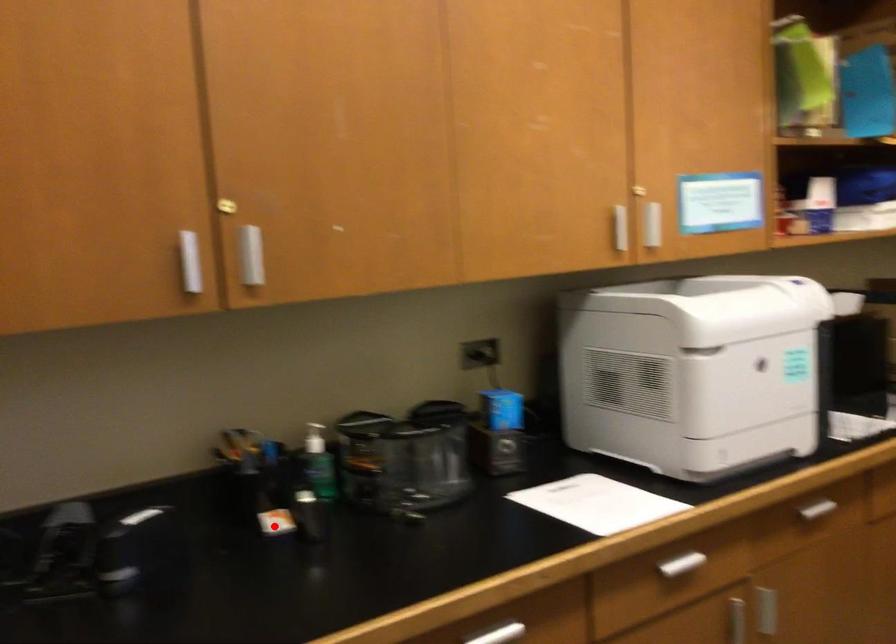
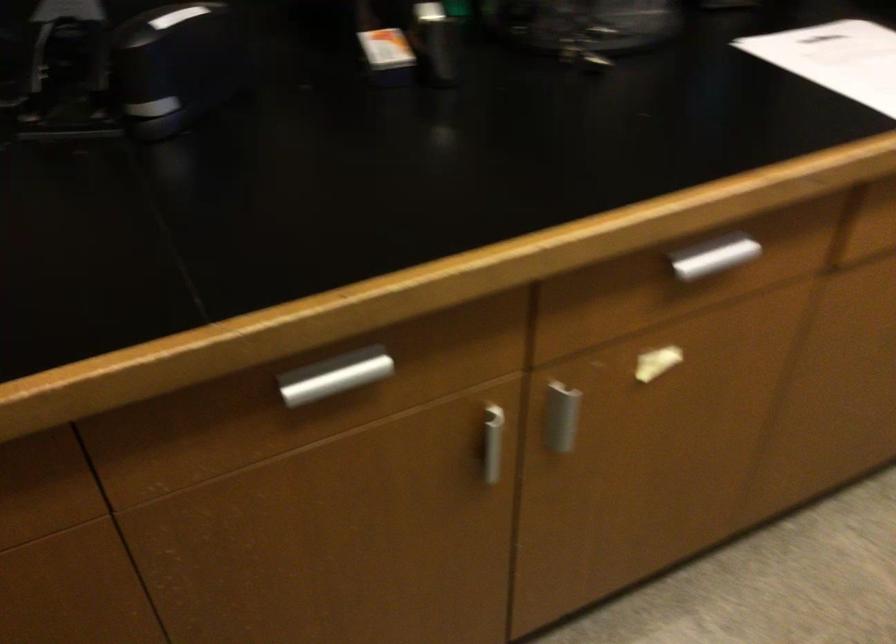
Where in the second image is the point corresponding to the highlighted location from the first image?

(386, 57)